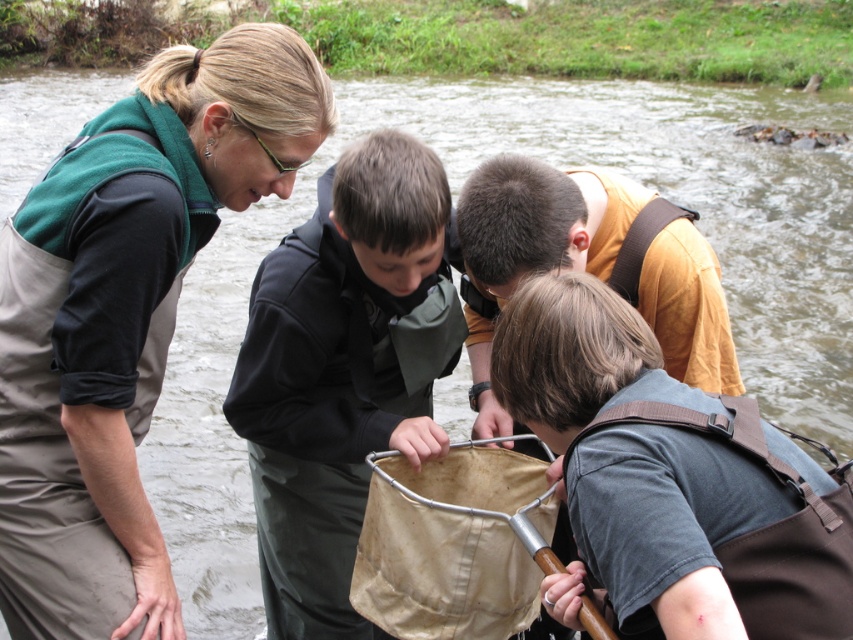
Question: Does matte gray waders at left appear on the left side of dark gray fabric jacket at center?

Choices:
 (A) yes
 (B) no

Answer: (A)

Question: Considering the real-world distances, which object is closest to the matte gray waders at left?

Choices:
 (A) orange cotton shirt at center
 (B) brown fabric backpack at lower right

Answer: (A)

Question: Is matte gray waders at left bigger than brown fabric backpack at lower right?

Choices:
 (A) no
 (B) yes

Answer: (B)

Question: Does matte gray waders at left have a larger size compared to brown fabric backpack at lower right?

Choices:
 (A) yes
 (B) no

Answer: (A)

Question: Which is nearer to the dark gray fabric jacket at center?

Choices:
 (A) brown fabric backpack at lower right
 (B) orange cotton shirt at center

Answer: (B)

Question: Which point is closer to the camera?

Choices:
 (A) (833, 573)
 (B) (421, 333)
 (C) (51, 436)

Answer: (A)